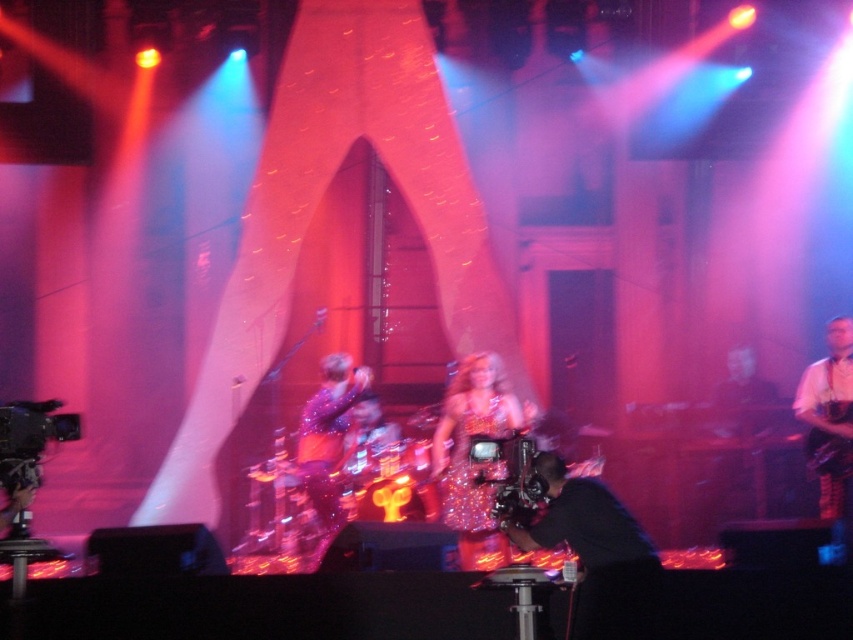
Consider the image. You are standing in the audience looking at the stage. There are two points marked on the stage. One is at coordinate point (549, 452) and the other is at point (817, 369). Which point is closer to you?

Point (549, 452) is closer to the viewer than point (817, 369).

You are a stagehand who needs to move the camera closer to the white leather guitar at right to get a better closeup shot. The stage has a clear path between them. What is the minimum distance you need to move the camera to achieve this?

The minimum distance you need to move the camera is 5.60 meters towards the white leather guitar at right to reduce the gap between them to zero for the closest possible position.

You are a stagehand who needs to move a 3.5 feet wide equipment cart from the left side of the stage to the right side. There are two guitars on stage, the white leather guitar at right and the black glossy guitar at center. Will the cart fit between them without hitting either guitar?

The white leather guitar at right is 5.00 feet from the black glossy guitar at center. Since the equipment cart is 3.5 feet wide, it can fit between them as the distance between the guitars is greater than the cart width.